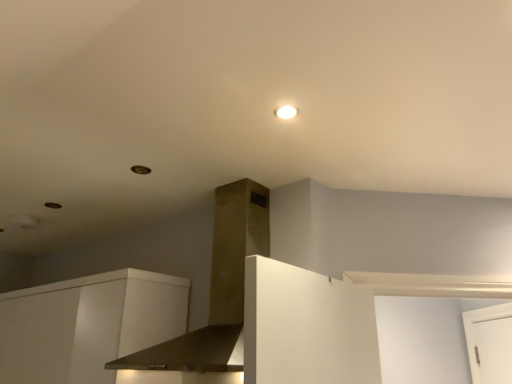
Question: Looking at their shapes, would you say satin gold vent at center is wider or thinner than white glossy light fixture at upper center?

Choices:
 (A) thin
 (B) wide

Answer: (B)

Question: From their relative heights in the image, would you say satin gold vent at center is taller or shorter than white glossy light fixture at upper center?

Choices:
 (A) tall
 (B) short

Answer: (A)

Question: Estimate the real-world distances between objects in this image. Which object is closer to the white glossy light fixture at upper center?

Choices:
 (A) satin gold vent at center
 (B) white matte cabinet at lower left

Answer: (A)

Question: Which is farther from the white glossy light fixture at upper center?

Choices:
 (A) satin gold vent at center
 (B) white matte cabinet at lower left

Answer: (B)